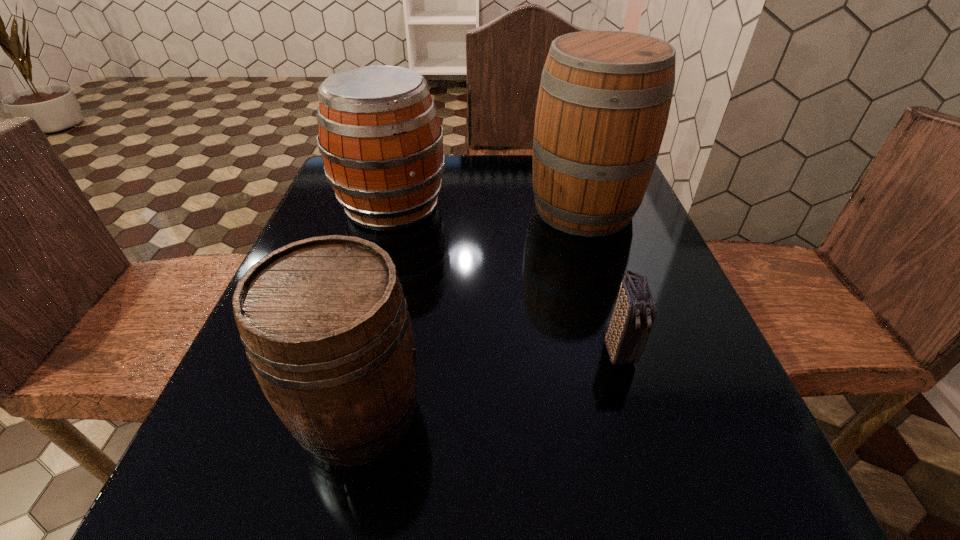
Locate which object ranks third in proximity to the tallest object. Please provide its 2D coordinates. Your answer should be formatted as a tuple, i.e. [(x, y)], where the tuple contains the x and y coordinates of a point satisfying the conditions above.

[(326, 328)]

Where is `object that stands as the second closest to the nearest cider`? The width and height of the screenshot is (960, 540). object that stands as the second closest to the nearest cider is located at coordinates (x=381, y=142).

The height and width of the screenshot is (540, 960). I want to click on cider that is the closest one to the tallest cider, so click(x=381, y=142).

The image size is (960, 540). I want to click on cider that stands as the third closest to the shortest object, so click(x=381, y=142).

Identify the location of vacant area that satisfies the following two spatial constraints: 1. with the zip open on the shortest object; 2. on the side of the nearest cider near the bung hole. The image size is (960, 540). (637, 413).